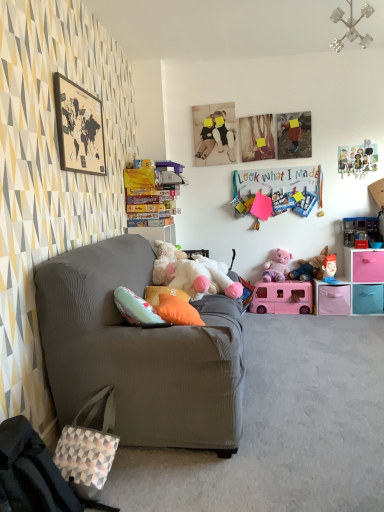
Measure the distance between wooden map at upper left and camera.

wooden map at upper left and camera are 7.11 feet apart.

In order to click on patterned fabric swivel chair at lower left in this screenshot , I will do `click(34, 474)`.

Locate an element on the screen. The image size is (384, 512). pink plastic van at center, the fourth toy positioned from the right is located at coordinates (282, 297).

What is the approximate width of metallic plastic toy at upper right, marked as the 1th toy in a right-to-left arrangement?

It is 5.92 inches.

The image size is (384, 512). Describe the element at coordinates (276, 266) in the screenshot. I see `plush purple bear at center-right, positioned as the 5th toy in right-to-left order` at that location.

Locate an element on the screen. This screenshot has width=384, height=512. matte plastic toy at right, the 5th toy from the left is located at coordinates (329, 268).

Image resolution: width=384 pixels, height=512 pixels. Find the location of `pillow that is below the matte plastic toy at right, which is the 2th toy in right-to-left order (from the image's perspective)`. pillow that is below the matte plastic toy at right, which is the 2th toy in right-to-left order (from the image's perspective) is located at coordinates (177, 311).

From the image's perspective, is orange fabric pillow at center under matte plastic toy at right, which is the 2th toy in right-to-left order?

Yes, from the image's perspective, orange fabric pillow at center is beneath matte plastic toy at right, which is the 2th toy in right-to-left order.

Is orange fabric pillow at center positioned in front of matte plastic toy at right, which is the 2th toy in right-to-left order?

Yes, orange fabric pillow at center is in front of matte plastic toy at right, which is the 2th toy in right-to-left order.

Which of these two, orange fabric pillow at center or matte plastic toy at right, which is the 2th toy in right-to-left order, stands taller?

matte plastic toy at right, which is the 2th toy in right-to-left order.

Which point is more forward, (296, 276) or (176, 279)?

The point (176, 279) is closer to the camera.

Is plush pink teddy bear at right, the 3th toy in the right-to-left sequence, next to fluffy white teddy bear at center, marked as the 6th toy in a right-to-left arrangement?

No, plush pink teddy bear at right, the 3th toy in the right-to-left sequence, is not in contact with fluffy white teddy bear at center, marked as the 6th toy in a right-to-left arrangement.

Which of these two, plush pink teddy bear at right, the 3th toy in the right-to-left sequence, or fluffy white teddy bear at center, marked as the 6th toy in a right-to-left arrangement, stands shorter?

Standing shorter between the two is plush pink teddy bear at right, the 3th toy in the right-to-left sequence.

Relative to fluffy white teddy bear at center, marked as the 6th toy in a right-to-left arrangement, is plush pink teddy bear at right, the 3th toy in the right-to-left sequence, in front or behind?

plush pink teddy bear at right, the 3th toy in the right-to-left sequence, is positioned farther from the viewer than fluffy white teddy bear at center, marked as the 6th toy in a right-to-left arrangement.

Is point (123, 382) closer to camera compared to point (310, 300)?

That is True.

Based on the photo, from the image's perspective, which one is positioned lower, matte gray couch at left or pink plastic van at center, positioned as the 3th toy in left-to-right order?

pink plastic van at center, positioned as the 3th toy in left-to-right order, appears lower in the image.

Looking at this image, is matte gray couch at left wider or thinner than pink plastic van at center, the fourth toy positioned from the right?

matte gray couch at left is wider than pink plastic van at center, the fourth toy positioned from the right.

Is point (325, 272) closer to camera compared to point (307, 307)?

That is False.

Identify the location of toy that is the 1st one above the pink plastic van at center, the fourth toy positioned from the right (from a real-world perspective). Image resolution: width=384 pixels, height=512 pixels. (329, 268).

Is matte plastic toy at right, which is the 2th toy in right-to-left order, aimed at pink plastic van at center, positioned as the 3th toy in left-to-right order?

No, matte plastic toy at right, which is the 2th toy in right-to-left order, is not turned towards pink plastic van at center, positioned as the 3th toy in left-to-right order.

How much distance is there between matte plastic toy at right, which is the 2th toy in right-to-left order, and pink plastic van at center, positioned as the 3th toy in left-to-right order?

They are 40.37 centimeters apart.

Is metallic plastic toy at upper right, marked as the 1th toy in a right-to-left arrangement, shorter than matte plastic toy at right, the 5th toy from the left?

Incorrect, the height of metallic plastic toy at upper right, marked as the 1th toy in a right-to-left arrangement, does not fall short of that of matte plastic toy at right, the 5th toy from the left.

What's the angular difference between metallic plastic toy at upper right, arranged as the sixth toy when viewed from the left, and matte plastic toy at right, the 5th toy from the left,'s facing directions?

metallic plastic toy at upper right, arranged as the sixth toy when viewed from the left, and matte plastic toy at right, the 5th toy from the left, are facing 0.53 degrees away from each other.

From the image's perspective, would you say metallic plastic toy at upper right, marked as the 1th toy in a right-to-left arrangement, is positioned over matte plastic toy at right, which is the 2th toy in right-to-left order?

Yes, from the image's perspective, metallic plastic toy at upper right, marked as the 1th toy in a right-to-left arrangement, is above matte plastic toy at right, which is the 2th toy in right-to-left order.

Would you consider metallic plastic toy at upper right, arranged as the sixth toy when viewed from the left, to be distant from matte plastic toy at right, the 5th toy from the left?

Actually, metallic plastic toy at upper right, arranged as the sixth toy when viewed from the left, and matte plastic toy at right, the 5th toy from the left, are a little close together.

Are matte plastic toy at right, which is the 2th toy in right-to-left order, and patterned fabric swivel chair at lower left beside each other?

No.

Does matte plastic toy at right, the 5th toy from the left, contain patterned fabric swivel chair at lower left?

That's incorrect, patterned fabric swivel chair at lower left is not inside matte plastic toy at right, the 5th toy from the left.

Considering the positions of objects matte plastic toy at right, which is the 2th toy in right-to-left order, and patterned fabric swivel chair at lower left in the image provided, who is more to the left, matte plastic toy at right, which is the 2th toy in right-to-left order, or patterned fabric swivel chair at lower left?

patterned fabric swivel chair at lower left is more to the left.

At what (x,y) coordinates should I click in order to perform the action: click on swivel chair on the left of matte plastic toy at right, which is the 2th toy in right-to-left order. Please return your answer as a coordinate pair (x, y). Looking at the image, I should click on (34, 474).

The width and height of the screenshot is (384, 512). I want to click on swivel chair on the left of orange fabric pillow at center, so click(34, 474).

Based on the photo, who is taller, orange fabric pillow at center or patterned fabric swivel chair at lower left?

patterned fabric swivel chair at lower left.

How different are the orientations of orange fabric pillow at center and patterned fabric swivel chair at lower left in degrees?

7.8 degrees.

From the image's perspective, is orange fabric pillow at center located beneath patterned fabric swivel chair at lower left?

No.

The height and width of the screenshot is (512, 384). What are the coordinates of `pillow to the left of matte plastic toy at right, the 5th toy from the left` in the screenshot? It's located at (177, 311).

Find the location of a particular element. The width and height of the screenshot is (384, 512). toy that is the 3rd one when counting upward from the fluffy white teddy bear at center, marked as the 6th toy in a right-to-left arrangement (from the image's perspective) is located at coordinates (309, 267).

From the image, which object appears to be farther from matte gray couch at left, fluffy white teddy bear at center, marked as the 6th toy in a right-to-left arrangement, or patterned fabric swivel chair at lower left?

Among the two, patterned fabric swivel chair at lower left is located further to matte gray couch at left.

Considering their positions, is matte gray couch at left positioned further to wooden map at upper left than fluffy white teddy bear at center, marked as the 6th toy in a right-to-left arrangement?

The object further to wooden map at upper left is fluffy white teddy bear at center, marked as the 6th toy in a right-to-left arrangement.

Looking at the image, which one is located closer to plush purple bear at center-right, which appears as the second toy when viewed from the left, matte gray couch at left or metallic plastic toy at upper right, arranged as the sixth toy when viewed from the left?

metallic plastic toy at upper right, arranged as the sixth toy when viewed from the left, lies closer to plush purple bear at center-right, which appears as the second toy when viewed from the left, than the other object.

Considering their positions, is patterned fabric swivel chair at lower left positioned further to fluffy white teddy bear at center, marked as the 6th toy in a right-to-left arrangement, than wooden map at upper left?

Based on the image, patterned fabric swivel chair at lower left appears to be further to fluffy white teddy bear at center, marked as the 6th toy in a right-to-left arrangement.

Which object lies nearer to the anchor point plush purple bear at center-right, positioned as the 5th toy in right-to-left order, pink plastic van at center, the fourth toy positioned from the right, or orange fabric pillow at center?

pink plastic van at center, the fourth toy positioned from the right.

Estimate the real-world distances between objects in this image. Which object is further from plush purple bear at center-right, positioned as the 5th toy in right-to-left order, metallic plastic toy at upper right, marked as the 1th toy in a right-to-left arrangement, or wooden map at upper left?

Among the two, wooden map at upper left is located further to plush purple bear at center-right, positioned as the 5th toy in right-to-left order.

Based on their spatial positions, is plush purple bear at center-right, which appears as the second toy when viewed from the left, or fluffy white teddy bear at center, marked as the 1th toy in a left-to-right arrangement, closer to patterned fabric swivel chair at lower left?

Among the two, fluffy white teddy bear at center, marked as the 1th toy in a left-to-right arrangement, is located nearer to patterned fabric swivel chair at lower left.

Considering their positions, is patterned fabric swivel chair at lower left positioned further to fluffy white teddy bear at center, marked as the 1th toy in a left-to-right arrangement, than matte gray couch at left?

patterned fabric swivel chair at lower left is further to fluffy white teddy bear at center, marked as the 1th toy in a left-to-right arrangement.

I want to click on studio couch between patterned fabric swivel chair at lower left and plush purple bear at center-right, which appears as the second toy when viewed from the left, from front to back, so click(x=139, y=351).

Locate an element on the screen. toy located between fluffy white teddy bear at center, marked as the 6th toy in a right-to-left arrangement, and plush pink teddy bear at right, which is the 4th toy in left-to-right order, in the depth direction is located at coordinates (329, 268).

Where is `picture frame between patterned fabric swivel chair at lower left and matte plastic toy at right, which is the 2th toy in right-to-left order, along the z-axis`? Image resolution: width=384 pixels, height=512 pixels. picture frame between patterned fabric swivel chair at lower left and matte plastic toy at right, which is the 2th toy in right-to-left order, along the z-axis is located at coordinates (79, 128).

At what (x,y) coordinates should I click in order to perform the action: click on pillow located between patterned fabric swivel chair at lower left and plush pink teddy bear at right, the 3th toy in the right-to-left sequence, in the depth direction. Please return your answer as a coordinate pair (x, y). The height and width of the screenshot is (512, 384). Looking at the image, I should click on (177, 311).